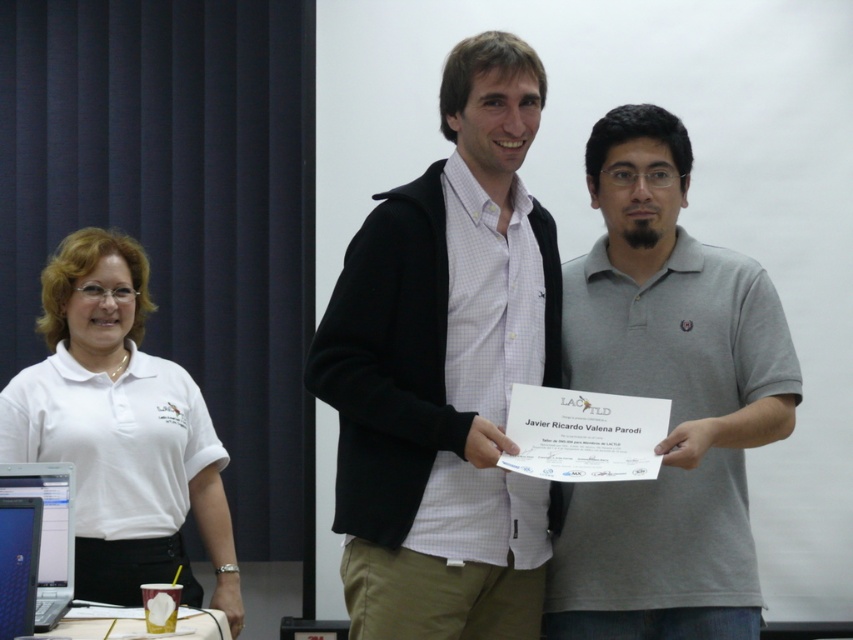
Between point (656, 531) and point (19, 531), which one is positioned behind?

The point (656, 531) is more distant.

Measure the distance between gray cotton polo shirt at center and camera.

1.92 meters

The height and width of the screenshot is (640, 853). I want to click on gray cotton polo shirt at center, so click(x=666, y=397).

Which is below, white checkered shirt at center or blue glossy laptop at lower left?

blue glossy laptop at lower left is below.

Does white checkered shirt at center come in front of blue glossy laptop at lower left?

Yes, it is.

Which is in front, point (450, 428) or point (49, 500)?

Point (450, 428)

Where is `white checkered shirt at center`? white checkered shirt at center is located at coordinates (445, 371).

Does white checkered shirt at center appear over white cotton shirt at left?

Indeed, white checkered shirt at center is positioned over white cotton shirt at left.

Between white checkered shirt at center and white cotton shirt at left, which one has less height?

white cotton shirt at left is shorter.

Between point (468, 205) and point (115, 442), which one is positioned behind?

The point (115, 442) is more distant.

You are a GUI agent. You are given a task and a screenshot of the screen. Output one action in this format:
    pyautogui.click(x=<x>, y=<y>)
    Task: Click on the white checkered shirt at center
    The image size is (853, 640).
    Given the screenshot: What is the action you would take?
    pyautogui.click(x=445, y=371)